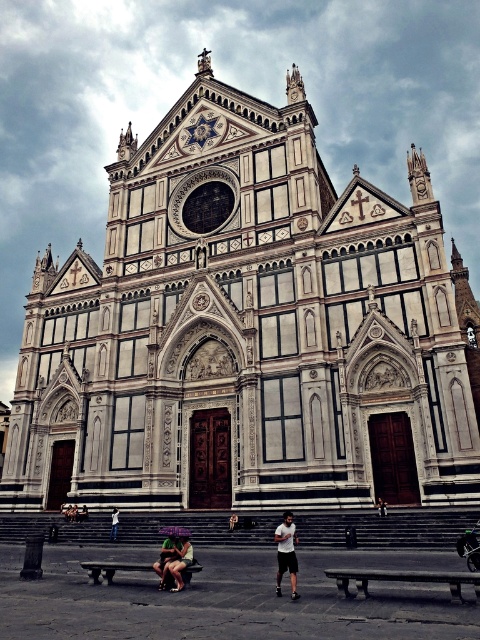
What do you see at coordinates (248, 330) in the screenshot? I see `white marble church at center` at bounding box center [248, 330].

From the picture: Is white marble church at center thinner than white cotton t-shirt at center?

No, white marble church at center is not thinner than white cotton t-shirt at center.

Describe the element at coordinates (248, 330) in the screenshot. This screenshot has height=640, width=480. I see `white marble church at center` at that location.

The width and height of the screenshot is (480, 640). Find the location of `white marble church at center`. white marble church at center is located at coordinates (248, 330).

Does green fabric person at center have a lesser height compared to light brown leather jacket at lower center?

Incorrect, green fabric person at center's height does not fall short of light brown leather jacket at lower center's.

Is green fabric person at center to the left of light brown leather jacket at lower center from the viewer's perspective?

Yes, green fabric person at center is to the left of light brown leather jacket at lower center.

The height and width of the screenshot is (640, 480). What do you see at coordinates (180, 561) in the screenshot? I see `green fabric person at center` at bounding box center [180, 561].

At what (x,y) coordinates should I click in order to perform the action: click on green fabric person at center. Please return your answer as a coordinate pair (x, y). The image size is (480, 640). Looking at the image, I should click on click(x=180, y=561).

Looking at this image, can you confirm if matte black shorts at lower center is wider than light blue jeans at center?

Correct, the width of matte black shorts at lower center exceeds that of light blue jeans at center.

Can you confirm if matte black shorts at lower center is shorter than light blue jeans at center?

No.

Between point (154, 568) and point (115, 522), which one is positioned in front?

Point (154, 568)

Image resolution: width=480 pixels, height=640 pixels. I want to click on matte black shorts at lower center, so click(167, 556).